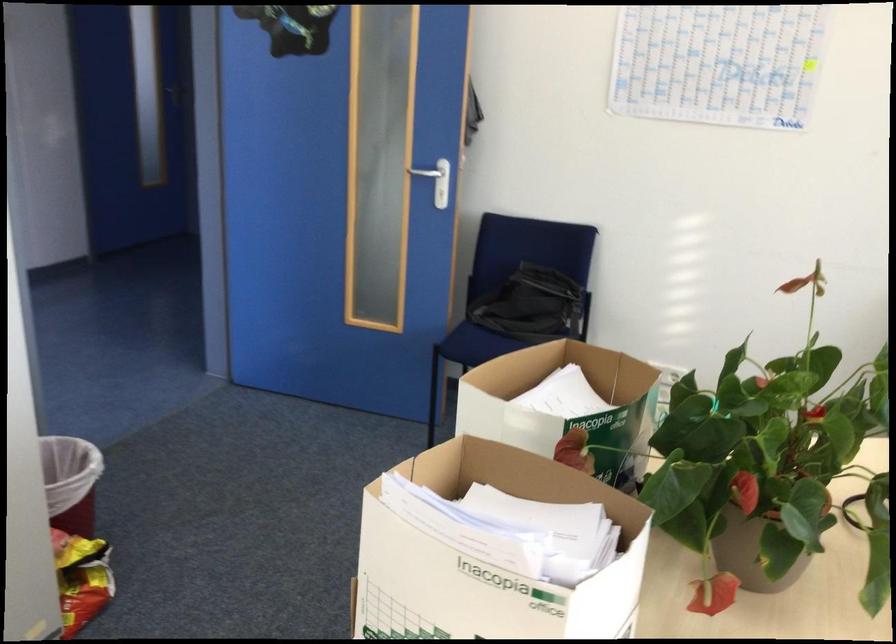
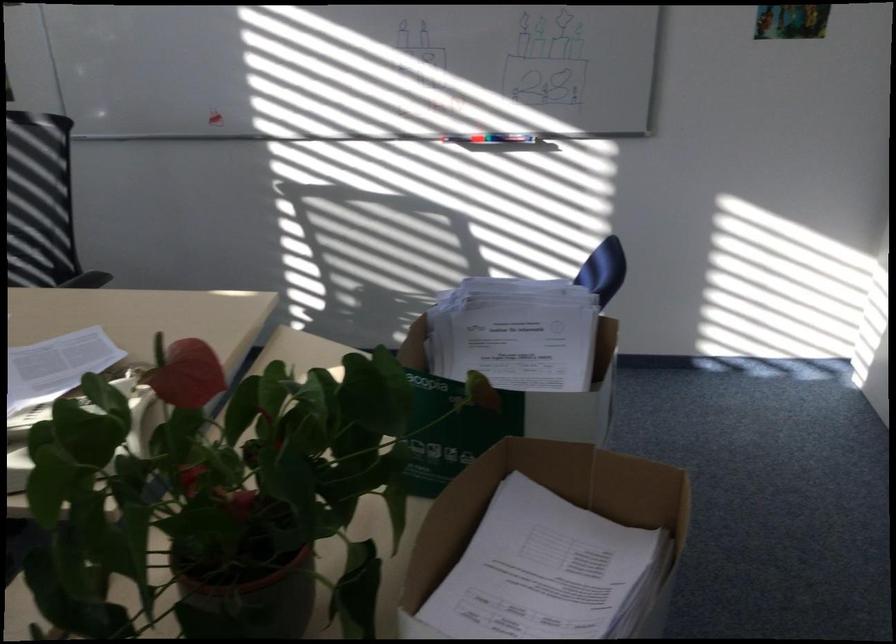
In the second image, find the point that corresponds to (497,551) in the first image.

(451, 431)